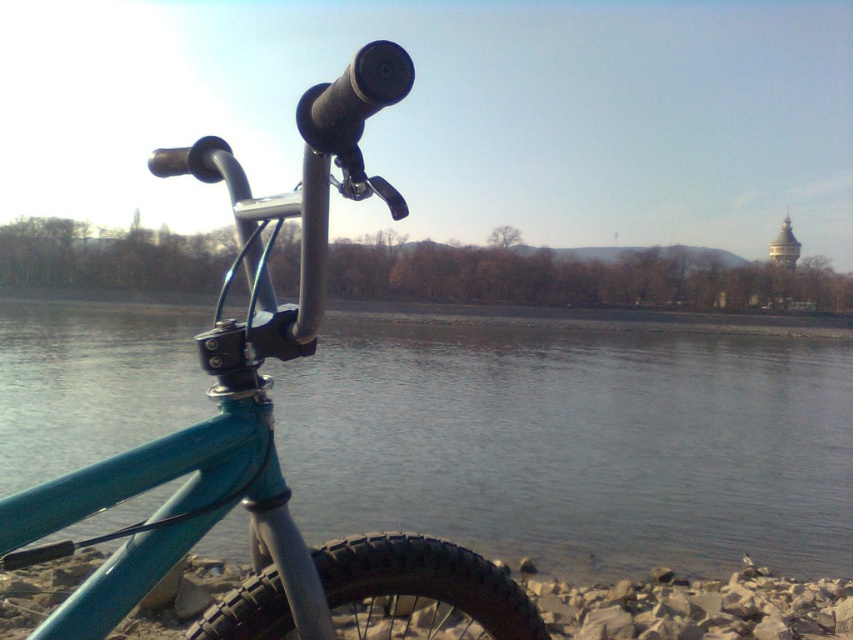
You are standing at the edge of the water and want to take a photo of the teal matte bicycle at center without the blue metallic water at lower center in the shot. Which direction should you move to achieve this?

The teal matte bicycle at center is behind the blue metallic water at lower center. To avoid including the blue metallic water at lower center in the photo, you should move backward away from the water so that the bicycle comes into focus while the water moves out of the frame.

You are standing at the edge of the water and want to cross to the other side using the teal matte bicycle at center as a bridge. Do you think the blue metallic water at lower center is wide enough to be crossed by stepping on the bicycle?

The blue metallic water at lower center might be wider than the teal matte bicycle at center, so it may not be safe to use the bicycle as a bridge since the water could be too wide for the bicycle to span.